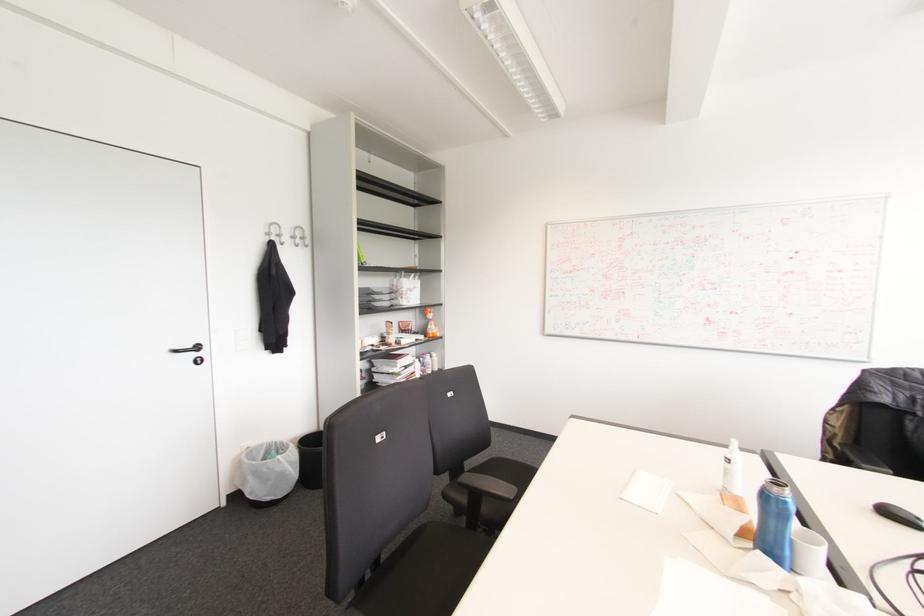
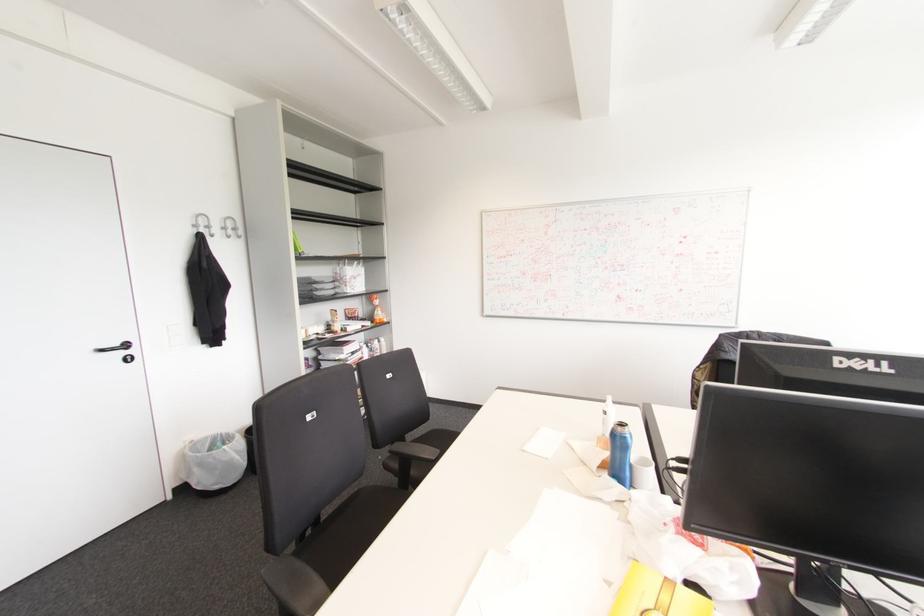
Where in the second image is the point corresponding to (197,347) from the first image?

(126, 345)